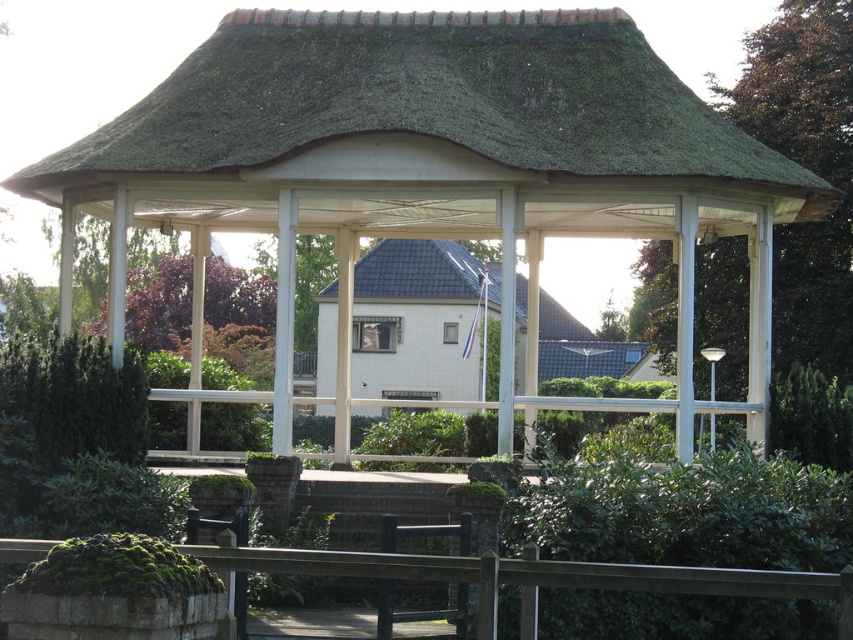
Who is taller, dark green leafy tree at upper right or dark gray shingles at center?

dark green leafy tree at upper right

Looking at this image, can you confirm if dark green leafy tree at upper right is positioned to the right of dark gray shingles at center?

Yes, dark green leafy tree at upper right is to the right of dark gray shingles at center.

Describe the element at coordinates (808, 168) in the screenshot. I see `dark green leafy tree at upper right` at that location.

Identify the location of dark green leafy tree at upper right. (808, 168).

Does green thatch roof at center have a greater height compared to dark green leafy tree at upper right?

Incorrect, green thatch roof at center's height is not larger of dark green leafy tree at upper right's.

Locate an element on the screen. green thatch roof at center is located at coordinates (428, 102).

Does point (253, 116) lie in front of point (660, 264)?

Yes, point (253, 116) is in front of point (660, 264).

Where is `green thatch roof at center`? This screenshot has width=853, height=640. green thatch roof at center is located at coordinates (428, 102).

Between point (311, 77) and point (305, 93), which one is positioned behind?

The point (311, 77) is behind.

In the scene shown: Is white wooden gazebo at center above green thatch roof at center?

No.

Which is behind, point (496, 109) or point (276, 44)?

Point (276, 44)

Locate an element on the screen. This screenshot has width=853, height=640. white wooden gazebo at center is located at coordinates (434, 166).